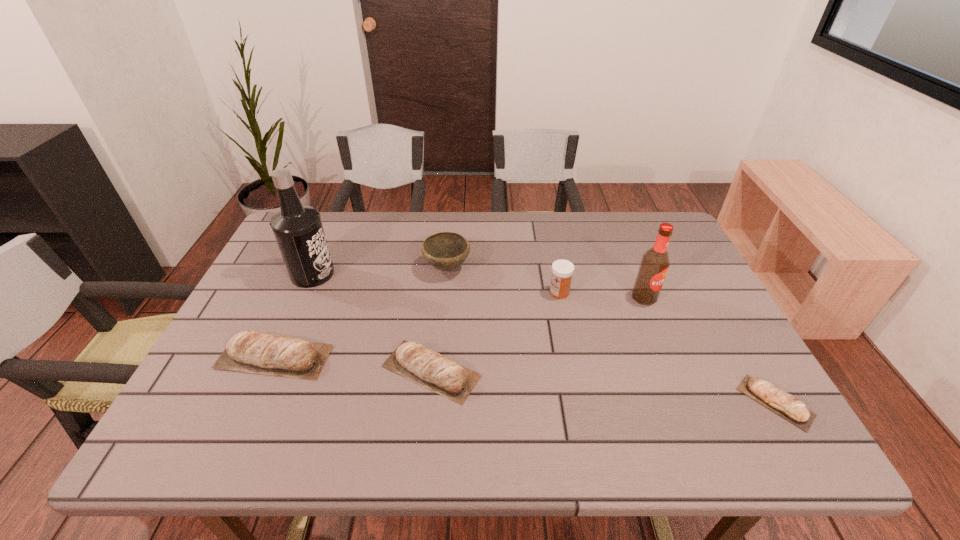
Where is `unoccupied position between the leftmost pita bread and the sixth shortest object`? The width and height of the screenshot is (960, 540). unoccupied position between the leftmost pita bread and the sixth shortest object is located at coordinates (459, 327).

This screenshot has height=540, width=960. In order to click on free space that is in between the second tallest pita bread and the shortest object in this screenshot , I will do `click(603, 387)`.

Where is `unoccupied position between the medicine and the shortest object`? The width and height of the screenshot is (960, 540). unoccupied position between the medicine and the shortest object is located at coordinates point(667,347).

Identify the location of empty space between the second object from right to left and the medicine. This screenshot has width=960, height=540. (602, 295).

Identify the location of free space between the third object from right to left and the rightmost pita bread. Image resolution: width=960 pixels, height=540 pixels. (667, 347).

Locate an element on the screen. The image size is (960, 540). free point between the sixth tallest object and the bowl is located at coordinates (439, 319).

Where is `vacant space that's between the fifth object from left to right and the tallest object`? The image size is (960, 540). vacant space that's between the fifth object from left to right and the tallest object is located at coordinates (436, 284).

You are a GUI agent. You are given a task and a screenshot of the screen. Output one action in this format:
    pyautogui.click(x=<x>, y=<y>)
    Task: Click on the vacant space in between the third object from right to left and the tallest object
    This screenshot has width=960, height=540.
    Given the screenshot: What is the action you would take?
    pyautogui.click(x=436, y=284)

Locate an element on the screen. empty location between the leftmost pita bread and the second tallest object is located at coordinates (459, 327).

Find the location of a particular element. empty space that is in between the leftmost pita bread and the second pita bread from left to right is located at coordinates (353, 364).